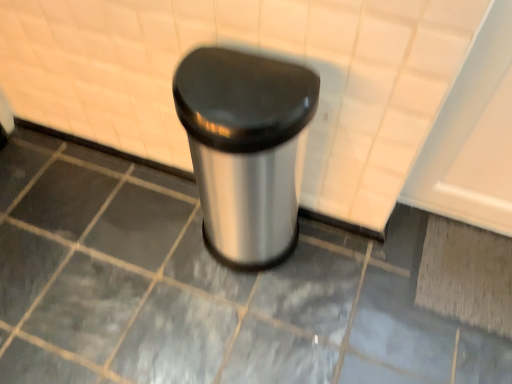
The width and height of the screenshot is (512, 384). I want to click on free space to the left of polished stainless steel trash can at center, so click(154, 238).